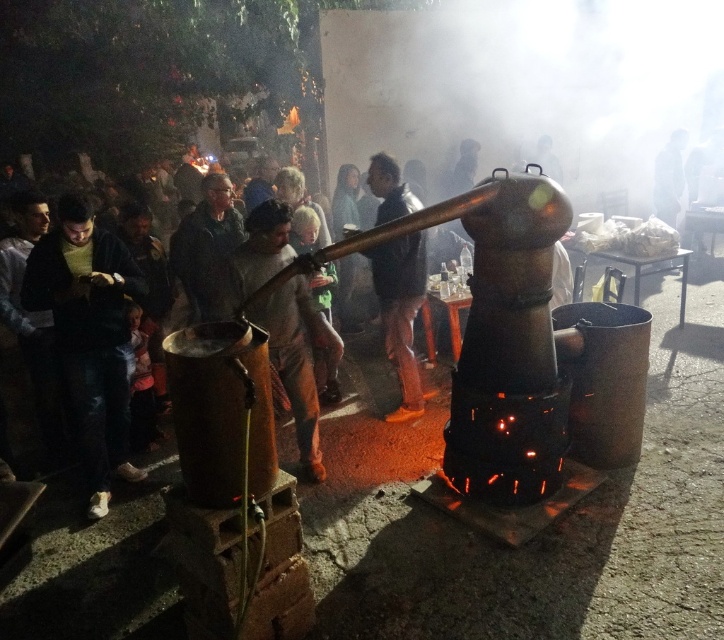
Which is behind, point (383, 211) or point (214, 198)?

Point (214, 198)

Looking at this image, is shiny black pants at center to the left of dark gray jacket at center from the viewer's perspective?

Incorrect, shiny black pants at center is not on the left side of dark gray jacket at center.

This screenshot has height=640, width=724. Identify the location of shiny black pants at center. tap(400, 312).

Can you confirm if dark green sweater at left is thinner than dark gray jacket at center?

Yes.

You are a GUI agent. You are given a task and a screenshot of the screen. Output one action in this format:
    pyautogui.click(x=<x>, y=<y>)
    Task: Click on the dark green sweater at left
    
    Given the screenshot: What is the action you would take?
    pyautogui.click(x=88, y=336)

Where is `dark green sweater at left`? This screenshot has height=640, width=724. dark green sweater at left is located at coordinates coord(88,336).

Who is higher up, dark green sweater at left or shiny black pants at center?

shiny black pants at center is higher up.

Who is more forward, (101, 470) or (421, 413)?

Point (101, 470) is in front.

The width and height of the screenshot is (724, 640). What are the coordinates of `dark green sweater at left` in the screenshot? It's located at (88, 336).